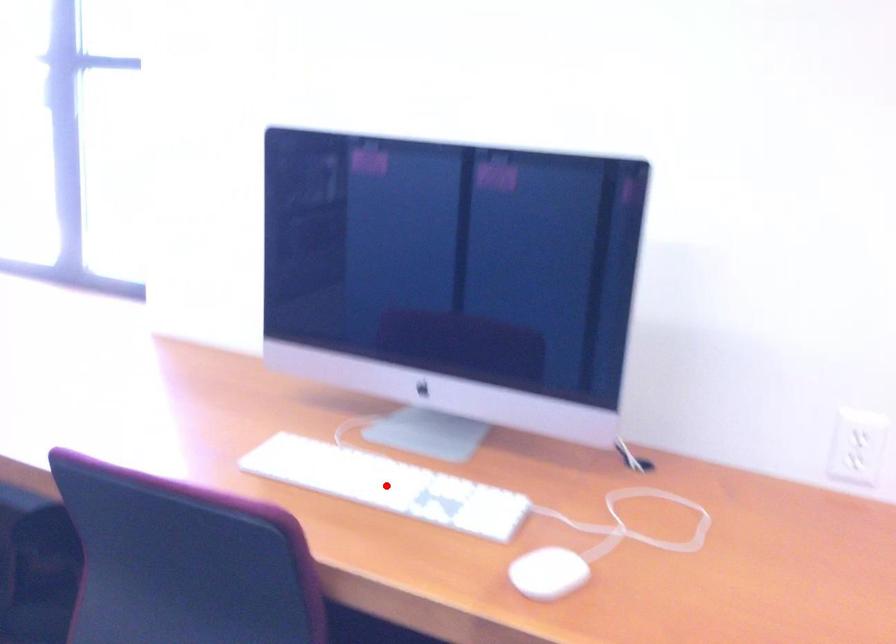
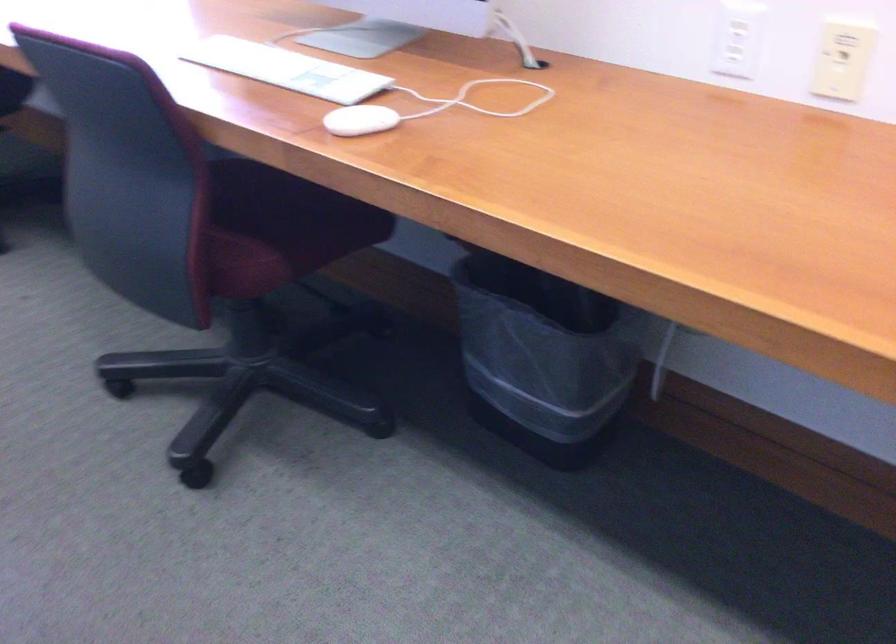
Question: I am providing you with two images of the same scene from different viewpoints. In image1, a red point is highlighted. Considering the same 3D point in image2, which of the following is correct?

Choices:
 (A) It is closer
 (B) It is farther

Answer: (B)